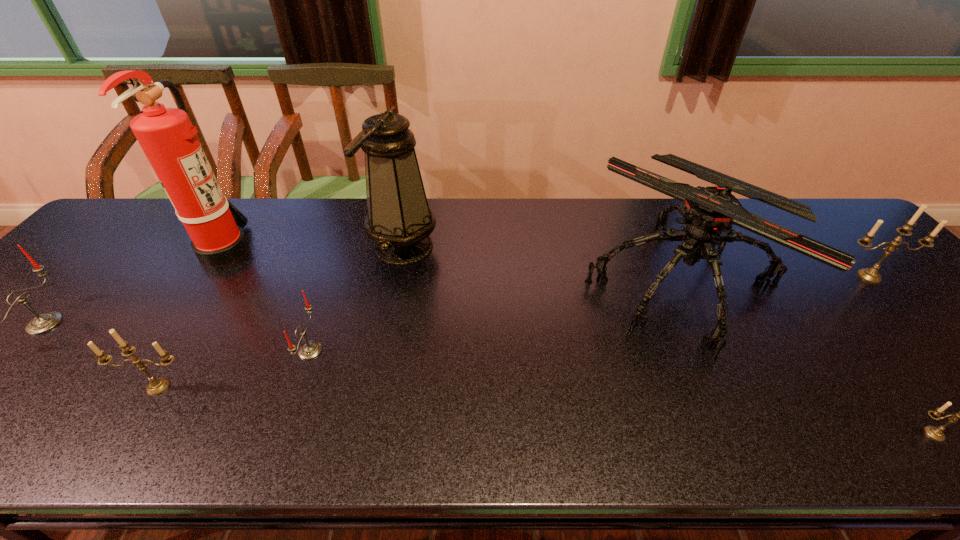
The image size is (960, 540). I want to click on blank region between the oil lamp and the black drone, so click(x=541, y=265).

Locate an element on the screen. vacant area that lies between the bigger red candle and the fourth object from left to right is located at coordinates (178, 337).

Where is `empty location between the fifth object from left to right and the fifth object from right to left`? The height and width of the screenshot is (540, 960). empty location between the fifth object from left to right and the fifth object from right to left is located at coordinates (356, 299).

The height and width of the screenshot is (540, 960). I want to click on free space between the seventh shortest object and the rightmost metallic candle, so click(636, 262).

Point out which object is positioned as the seventh nearest to the smaller red candle. Please provide its 2D coordinates. Your answer should be formatted as a tuple, i.e. [(x, y)], where the tuple contains the x and y coordinates of a point satisfying the conditions above.

[(871, 275)]

You are a GUI agent. You are given a task and a screenshot of the screen. Output one action in this format:
    pyautogui.click(x=<x>, y=<y>)
    Task: Click on the closest object to the fourth object from left to right
    
    Given the screenshot: What is the action you would take?
    pyautogui.click(x=399, y=220)

What are the coordinates of `candle that is the second closest one to the nearest metallic candle` in the screenshot? It's located at (309, 350).

This screenshot has height=540, width=960. I want to click on candle that is the second closest to the second candle from right to left, so click(309, 350).

Where is `the second closest metallic candle relative to the second biggest metallic candle`? This screenshot has height=540, width=960. the second closest metallic candle relative to the second biggest metallic candle is located at coordinates (871, 275).

This screenshot has width=960, height=540. I want to click on metallic candle that stands as the second closest to the fourth object from right to left, so click(x=935, y=433).